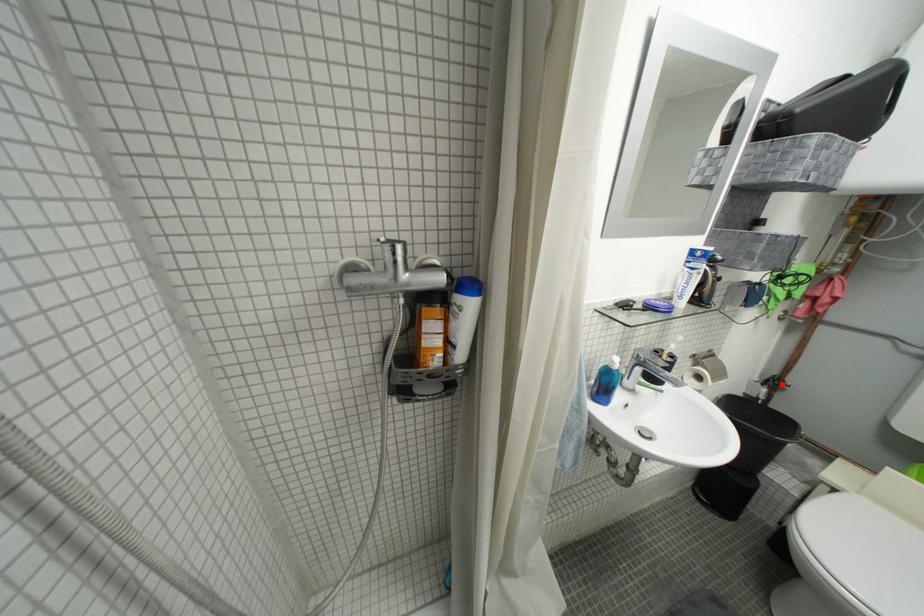
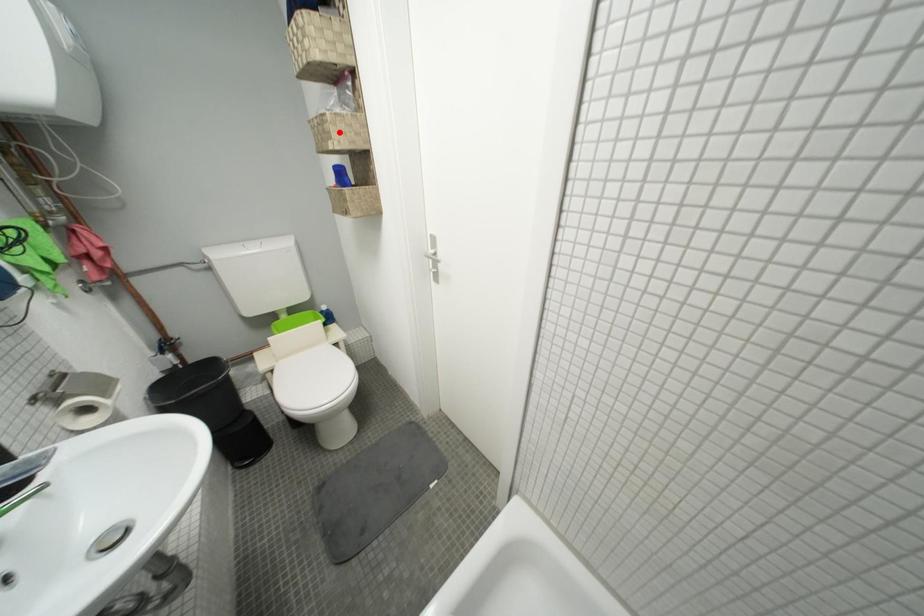
I am providing you with two images of the same scene from different viewpoints. A red point is marked on the first image and another point is marked on the second image. Does the point marked in image1 correspond to the same location as the one in image2?

No